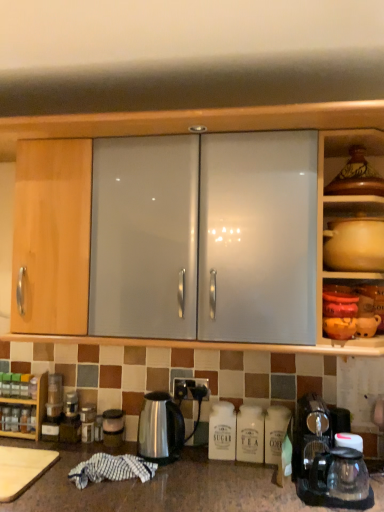
Where is `wooden spice rack at lower left, the first cabinetry in the back-to-front sequence`? wooden spice rack at lower left, the first cabinetry in the back-to-front sequence is located at coordinates (30, 405).

What do you see at coordinates (191, 388) in the screenshot? I see `satin black socket at center` at bounding box center [191, 388].

Measure the distance between satin black socket at center and camera.

satin black socket at center is 5.81 feet from camera.

What is the approximate height of matte brown pot at upper right?

It is 21.34 centimeters.

Where is `satin silver kettle at center`? The image size is (384, 512). satin silver kettle at center is located at coordinates (160, 428).

Can you confirm if transparent glass coffee machine at lower right is positioned to the left of white glossy towel at lower left?

Incorrect, transparent glass coffee machine at lower right is not on the left side of white glossy towel at lower left.

Measure the distance from transparent glass coffee machine at lower right to white glossy towel at lower left.

transparent glass coffee machine at lower right is 38.26 inches away from white glossy towel at lower left.

Does transparent glass coffee machine at lower right have a larger size compared to white glossy towel at lower left?

Correct, transparent glass coffee machine at lower right is larger in size than white glossy towel at lower left.

Locate an element on the screen. The width and height of the screenshot is (384, 512). kitchen appliance below the transparent glass coffee machine at lower right (from a real-world perspective) is located at coordinates (22, 469).

Which is correct: matte ceramic pot at upper right, which is the second cabinetry from left to right, is inside transparent glass coffee machine at lower right, or outside of it?

matte ceramic pot at upper right, which is the second cabinetry from left to right, is not enclosed by transparent glass coffee machine at lower right.

Could you tell me if matte ceramic pot at upper right, the 1th cabinetry from the front, is facing transparent glass coffee machine at lower right?

No, matte ceramic pot at upper right, the 1th cabinetry from the front, is not aimed at transparent glass coffee machine at lower right.

Can you confirm if matte ceramic pot at upper right, the 1th cabinetry from the right, is smaller than transparent glass coffee machine at lower right?

Actually, matte ceramic pot at upper right, the 1th cabinetry from the right, might be larger than transparent glass coffee machine at lower right.

Could you tell me if satin silver canister at lower center, placed as the second appliance when sorted from left to right, is turned towards satin silver kettle at center?

No, satin silver canister at lower center, placed as the second appliance when sorted from left to right, is not turned towards satin silver kettle at center.

The image size is (384, 512). In order to click on kettle above the satin silver canister at lower center, placed as the first appliance when sorted from right to left (from the image's perspective) in this screenshot , I will do `click(160, 428)`.

From the image's perspective, between satin silver canister at lower center, placed as the second appliance when sorted from left to right, and satin silver kettle at center, which one is located above?

From the image's view, satin silver kettle at center is above.

How different are the orientations of satin silver canister at lower center, placed as the second appliance when sorted from left to right, and satin silver kettle at center in degrees?

The facing directions of satin silver canister at lower center, placed as the second appliance when sorted from left to right, and satin silver kettle at center are 3.09 degrees apart.

Considering their positions, is wooden spice rack at lower left, which is counted as the first cabinetry, starting from the bottom, located in front of or behind transparent glass coffee machine at lower right?

Clearly, wooden spice rack at lower left, which is counted as the first cabinetry, starting from the bottom, is behind transparent glass coffee machine at lower right.

Where is `cabinetry lying below the transparent glass coffee machine at lower right (from the image's perspective)`? cabinetry lying below the transparent glass coffee machine at lower right (from the image's perspective) is located at coordinates (30, 405).

Are wooden spice rack at lower left, marked as the first cabinetry in a left-to-right arrangement, and transparent glass coffee machine at lower right making contact?

wooden spice rack at lower left, marked as the first cabinetry in a left-to-right arrangement, and transparent glass coffee machine at lower right are clearly separated.

From the picture: From a real-world perspective, is white glossy towel at lower left positioned under brown matte vase at upper right based on gravity?

Yes.

Is white glossy towel at lower left positioned with its back to brown matte vase at upper right?

No, white glossy towel at lower left is not facing the opposite direction of brown matte vase at upper right.

Identify the location of kitchen appliance located below the brown matte vase at upper right (from the image's perspective). This screenshot has height=512, width=384. (22, 469).

Considering the points (1, 479) and (350, 186), which point is in front, point (1, 479) or point (350, 186)?

The point (1, 479) is closer.

Is satin silver canister at lower center, placed as the second appliance when sorted from left to right, far from transparent glass coffee machine at lower right?

They are positioned close to each other.

From a real-world perspective, which object rests below the other?

From a 3D spatial view, satin silver canister at lower center, placed as the first appliance when sorted from right to left, is below.

Is satin silver canister at lower center, placed as the second appliance when sorted from left to right, positioned beyond the bounds of transparent glass coffee machine at lower right?

That's correct, satin silver canister at lower center, placed as the second appliance when sorted from left to right, is outside of transparent glass coffee machine at lower right.

Between satin silver canister at lower center, placed as the second appliance when sorted from left to right, and transparent glass coffee machine at lower right, which one has less height?

Standing shorter between the two is satin silver canister at lower center, placed as the second appliance when sorted from left to right.

Which is nearer, (351, 154) or (117, 439)?

The point (351, 154) is in front.

Which of these two, brown matte vase at upper right or satin silver canister at lower center, placed as the second appliance when sorted from left to right, stands shorter?

With less height is satin silver canister at lower center, placed as the second appliance when sorted from left to right.

Is brown matte vase at upper right wider than satin silver canister at lower center, placed as the second appliance when sorted from left to right?

Yes, brown matte vase at upper right is wider than satin silver canister at lower center, placed as the second appliance when sorted from left to right.

Locate an element on the screen. This screenshot has width=384, height=512. coffee machine above the white glossy towel at lower left (from a real-world perspective) is located at coordinates (327, 462).

At what (x,y) coordinates should I click in order to perform the action: click on cabinetry that is above the transparent glass coffee machine at lower right (from the image's perspective). Please return your answer as a coordinate pair (x, y). The width and height of the screenshot is (384, 512). Looking at the image, I should click on (351, 223).

Based on their spatial positions, is wooden spice rack at lower left, the second cabinetry positioned from the front, or satin black socket at center further from brown matte vase at upper right?

wooden spice rack at lower left, the second cabinetry positioned from the front, is further to brown matte vase at upper right.

From the image, which object appears to be farther from satin silver kettle at lower left, acting as the second appliance starting from the right, satin silver kettle at center or matte brown pot at upper right?

matte brown pot at upper right lies further to satin silver kettle at lower left, acting as the second appliance starting from the right, than the other object.

Based on their spatial positions, is transparent glass coffee machine at lower right or satin black socket at center further from satin silver canister at lower center, placed as the first appliance when sorted from right to left?

transparent glass coffee machine at lower right is positioned further to the anchor satin silver canister at lower center, placed as the first appliance when sorted from right to left.

Estimate the real-world distances between objects in this image. Which object is further from white glossy towel at lower left, satin black socket at center or satin silver kettle at center?

satin black socket at center is positioned further to the anchor white glossy towel at lower left.

Which object lies further to the anchor point brown matte vase at upper right, satin silver kettle at center or satin black socket at center?

Based on the image, satin silver kettle at center appears to be further to brown matte vase at upper right.

From the image, which object appears to be nearer to white glossy towel at lower left, brown matte vase at upper right or satin silver kettle at center?

The object closer to white glossy towel at lower left is satin silver kettle at center.

Based on the photo, which object lies nearer to the anchor point white glossy towel at lower left, matte brown pot at upper right or satin black socket at center?

Based on the image, satin black socket at center appears to be nearer to white glossy towel at lower left.

Looking at the image, which one is located further to wooden spice rack at lower left, the 2th cabinetry from the top, satin silver kettle at lower left, which is counted as the first appliance, starting from the left, or satin silver kettle at center?

The object further to wooden spice rack at lower left, the 2th cabinetry from the top, is satin silver kettle at center.

Locate an element on the screen. kitchen appliance situated between wooden spice rack at lower left, marked as the first cabinetry in a left-to-right arrangement, and matte brown pot at upper right from left to right is located at coordinates (22, 469).

You are a GUI agent. You are given a task and a screenshot of the screen. Output one action in this format:
    pyautogui.click(x=<x>, y=<y>)
    Task: Click on the kettle located between satin silver kettle at lower left, acting as the second appliance starting from the right, and satin black socket at center in the left-right direction
    
    Given the screenshot: What is the action you would take?
    pyautogui.click(x=160, y=428)

Identify the location of electric outlet that lies between brown matte vase at upper right and satin silver kettle at center from top to bottom. Image resolution: width=384 pixels, height=512 pixels. (191, 388).

This screenshot has height=512, width=384. I want to click on kitchen appliance situated between wooden spice rack at lower left, which is counted as the first cabinetry, starting from the bottom, and brown matte vase at upper right from left to right, so click(x=22, y=469).